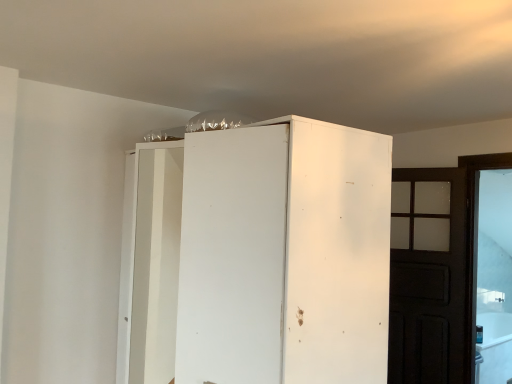
Question: Is dark wood door at right next to white matte cabinet at center and touching it?

Choices:
 (A) no
 (B) yes

Answer: (A)

Question: Is dark wood door at right at the left side of white matte cabinet at center?

Choices:
 (A) no
 (B) yes

Answer: (A)

Question: From the image's perspective, is dark wood door at right located above white matte cabinet at center?

Choices:
 (A) no
 (B) yes

Answer: (A)

Question: Can you confirm if dark wood door at right is bigger than white matte cabinet at center?

Choices:
 (A) yes
 (B) no

Answer: (B)

Question: Does dark wood door at right have a smaller size compared to white matte cabinet at center?

Choices:
 (A) yes
 (B) no

Answer: (A)

Question: Is dark wood door at right far from white matte cabinet at center?

Choices:
 (A) yes
 (B) no

Answer: (A)

Question: Does white matte cabinet at center have a greater width compared to dark wood door at right?

Choices:
 (A) yes
 (B) no

Answer: (A)

Question: Can you confirm if white matte cabinet at center is positioned to the left of dark wood door at right?

Choices:
 (A) yes
 (B) no

Answer: (A)

Question: Is white matte cabinet at center smaller than dark wood door at right?

Choices:
 (A) yes
 (B) no

Answer: (B)

Question: Considering the relative sizes of white matte cabinet at center and dark wood door at right in the image provided, is white matte cabinet at center thinner than dark wood door at right?

Choices:
 (A) no
 (B) yes

Answer: (A)

Question: From the image's perspective, is white matte cabinet at center located beneath dark wood door at right?

Choices:
 (A) no
 (B) yes

Answer: (A)

Question: Is white matte cabinet at center taller than dark wood door at right?

Choices:
 (A) no
 (B) yes

Answer: (A)

Question: Based on their sizes in the image, would you say dark wood door at right is bigger or smaller than white matte cabinet at center?

Choices:
 (A) small
 (B) big

Answer: (A)